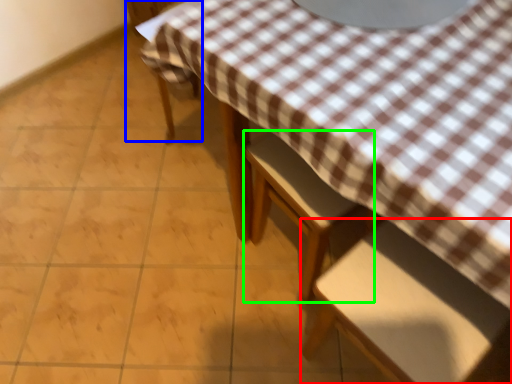
Question: Which object is positioned farthest from chair (highlighted by a red box)? Select from chair (highlighted by a blue box) and chair (highlighted by a green box).

Choices:
 (A) chair
 (B) chair

Answer: (A)